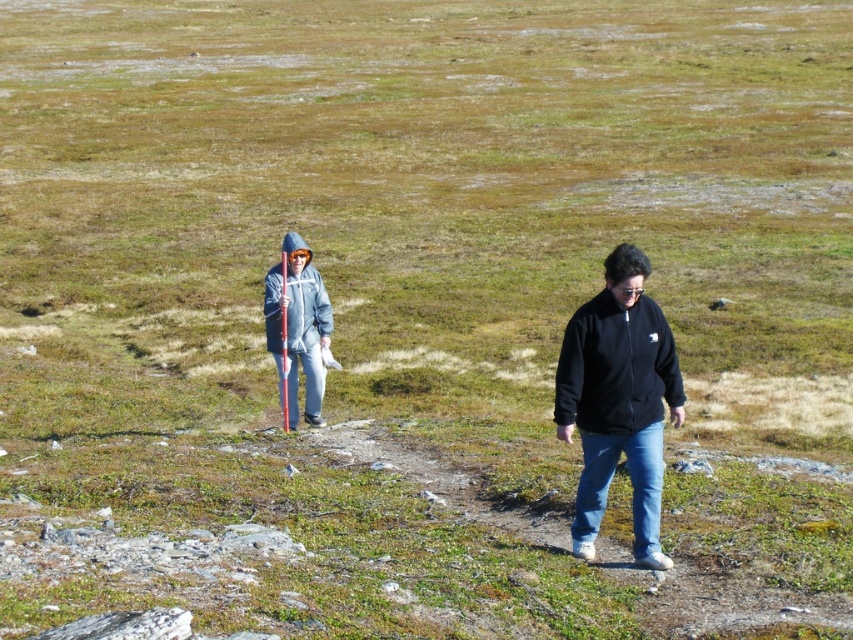
Question: Is black fleece sweatshirt at center to the left of matte gray jacket at center from the viewer's perspective?

Choices:
 (A) yes
 (B) no

Answer: (B)

Question: Among these points, which one is farthest from the camera?

Choices:
 (A) (294, 387)
 (B) (589, 323)

Answer: (A)

Question: Is black fleece sweatshirt at center positioned at the back of matte gray jacket at center?

Choices:
 (A) no
 (B) yes

Answer: (A)

Question: Which of the following is the closest to the observer?

Choices:
 (A) (267, 342)
 (B) (665, 388)

Answer: (B)

Question: Does black fleece sweatshirt at center appear on the left side of matte gray jacket at center?

Choices:
 (A) yes
 (B) no

Answer: (B)

Question: Which point appears farthest from the camera in this image?

Choices:
 (A) (282, 248)
 (B) (563, 365)

Answer: (A)